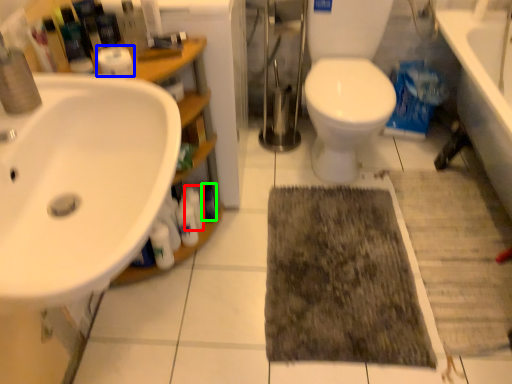
Question: Which is farther away from toiletry (highlighted by a red box)? toilet paper (highlighted by a blue box) or toiletry (highlighted by a green box)?

Choices:
 (A) toilet paper
 (B) toiletry

Answer: (A)